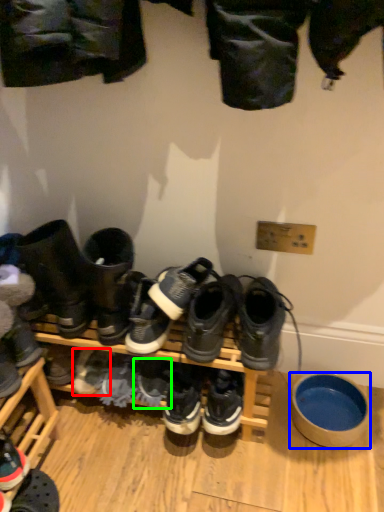
Question: Which is farther away from footwear (highlighted by a red box)? bowl (highlighted by a blue box) or shoe (highlighted by a green box)?

Choices:
 (A) bowl
 (B) shoe

Answer: (A)